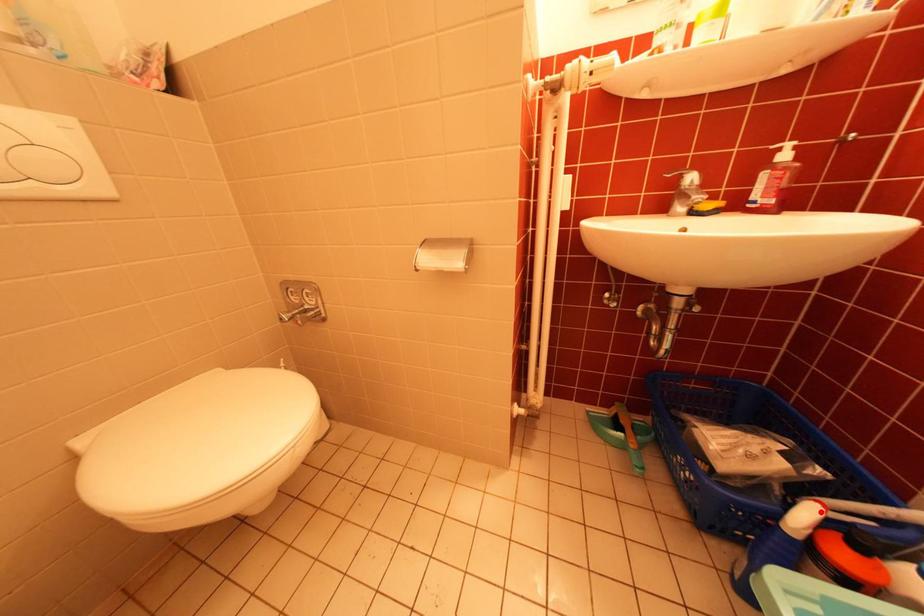
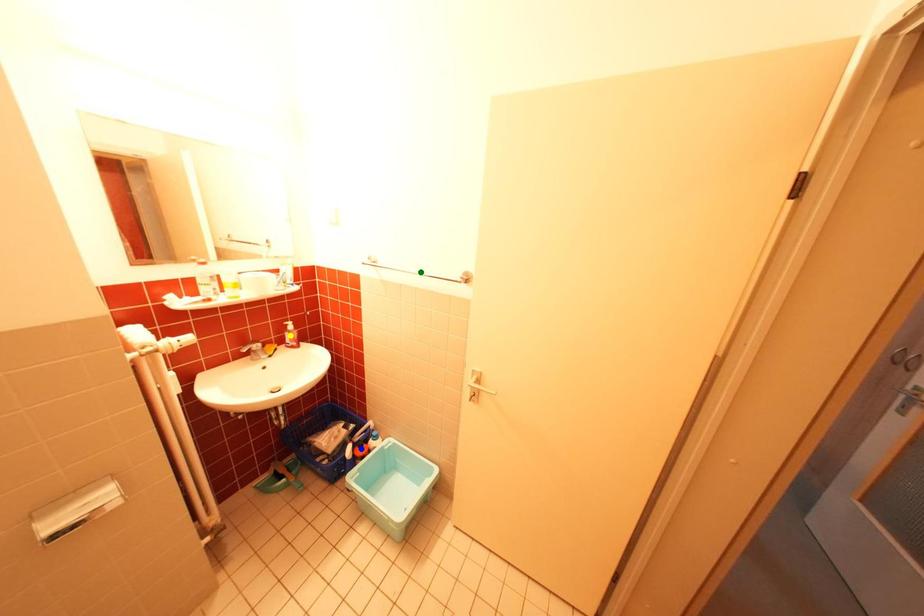
Question: I am providing you with two images of the same scene from different viewpoints. A red point is marked on the first image. You are given multiple points on the second image. Can you choose the point in image 2 that corresponds to the point in image 1?

Choices:
 (A) blue point
 (B) yellow point
 (C) green point

Answer: (A)